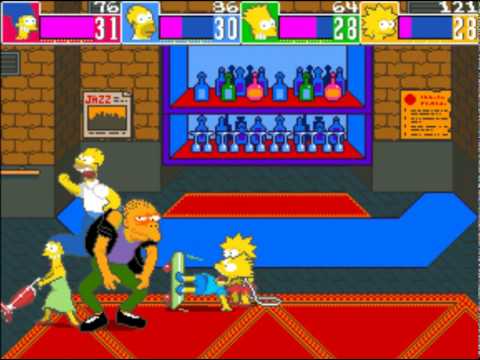
Identify the location of vaccumm. (23, 298).